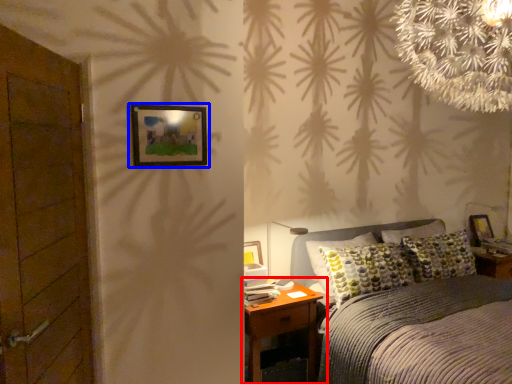
Question: Which of the following is the farthest to the observer, nightstand (highlighted by a red box) or picture frame (highlighted by a blue box)?

Choices:
 (A) nightstand
 (B) picture frame

Answer: (A)